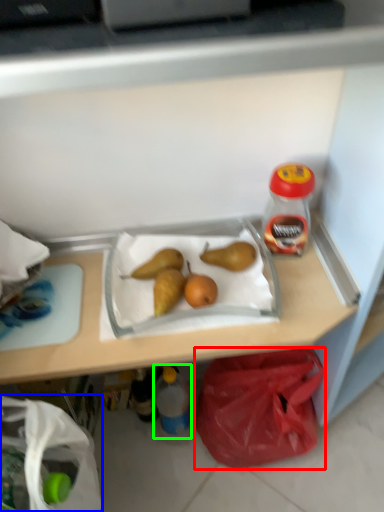
Question: Which object is the closest to the plastic bag (highlighted by a red box)? Choose among these: grocery bag (highlighted by a blue box) or bottle (highlighted by a green box).

Choices:
 (A) grocery bag
 (B) bottle

Answer: (B)